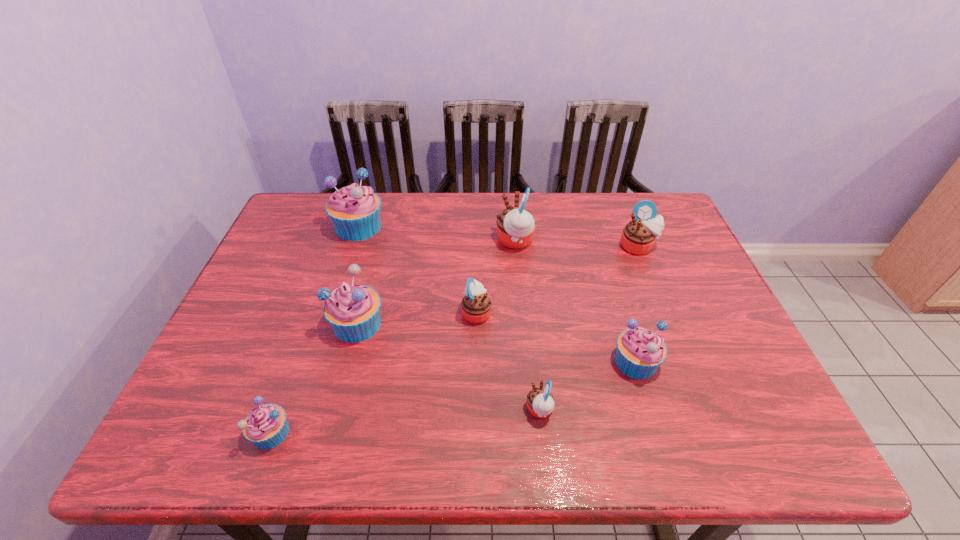
Where is `blank space at the right edge`? The image size is (960, 540). blank space at the right edge is located at coordinates (679, 337).

In the image, there is a desktop. In order to click on vacant space at the far left corner in this screenshot , I will do `click(298, 200)`.

I want to click on vacant space at the near right corner of the desktop, so click(780, 439).

This screenshot has width=960, height=540. Find the location of `blank region between the seventh muffin from left to right and the second nearest pink muffin`. blank region between the seventh muffin from left to right and the second nearest pink muffin is located at coordinates (556, 337).

Identify the location of unoccupied area between the biggest blue muffin and the second muffin from right to left. This screenshot has width=960, height=540. (497, 294).

This screenshot has height=540, width=960. What are the coordinates of `free point between the smallest pink muffin and the biggest pink muffin` in the screenshot? It's located at (527, 326).

The height and width of the screenshot is (540, 960). Find the location of `free space between the fifth object from right to left and the second object from right to left`. free space between the fifth object from right to left and the second object from right to left is located at coordinates (556, 337).

Where is `empty location between the nearest blue muffin and the second biggest pink muffin`? empty location between the nearest blue muffin and the second biggest pink muffin is located at coordinates tap(455, 340).

The image size is (960, 540). I want to click on free space between the second smallest pink muffin and the rightmost object, so click(x=557, y=280).

Locate an element on the screen. free space that is in between the rightmost muffin and the fourth muffin from left to right is located at coordinates (557, 280).